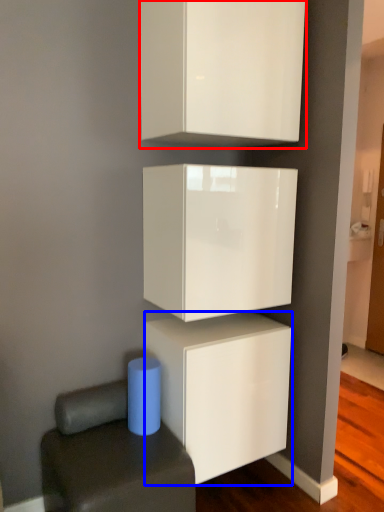
Question: Which object appears farthest to the camera in this image, cabinetry (highlighted by a red box) or cabinetry (highlighted by a blue box)?

Choices:
 (A) cabinetry
 (B) cabinetry

Answer: (B)